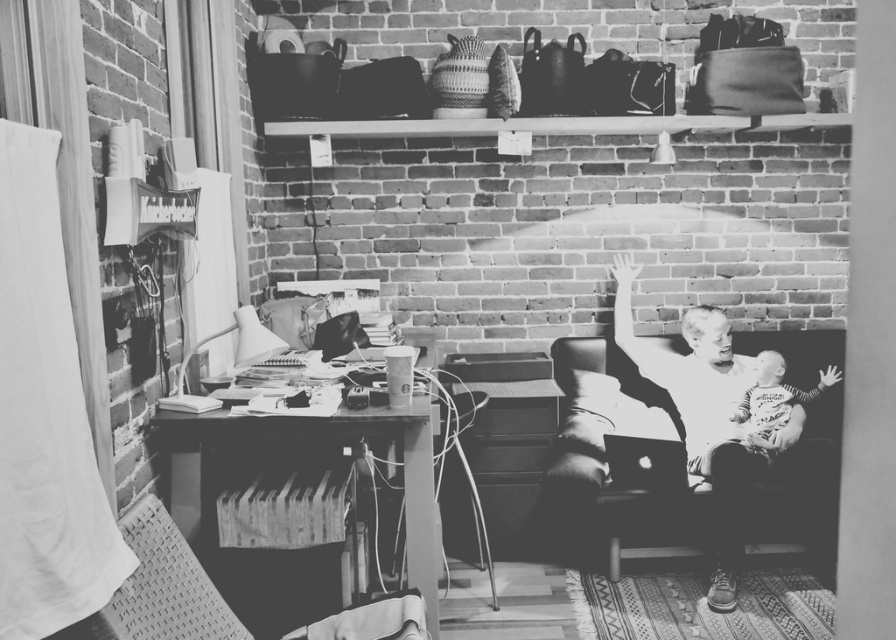
Does point (668, 522) lie behind point (419, 540)?

That is True.

Which is in front, point (599, 493) or point (388, 429)?

Point (388, 429) is more forward.

From the picture: Who is more forward, (746, 509) or (412, 429)?

Point (412, 429)

Where is `soft leather couch at center`? This screenshot has width=896, height=640. soft leather couch at center is located at coordinates (604, 464).